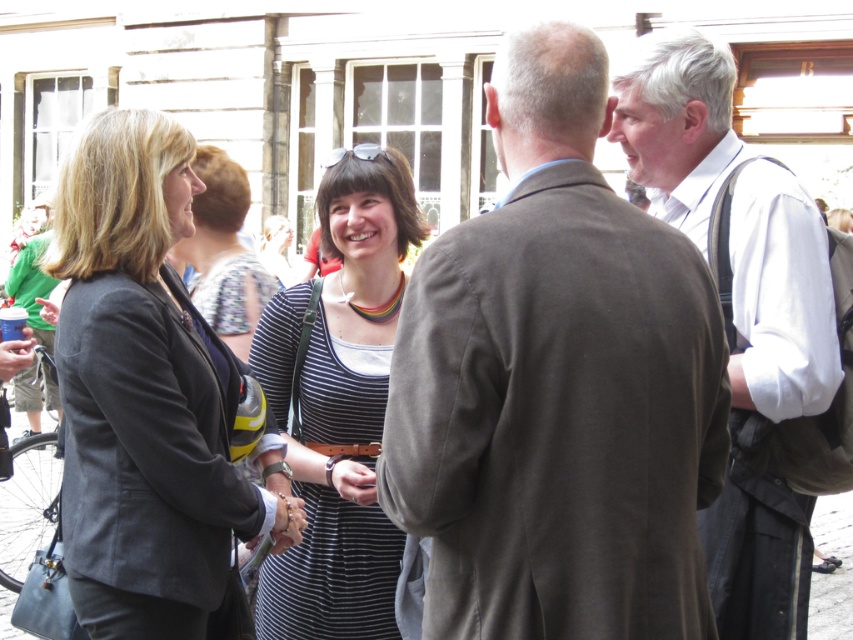
Question: Does white shirt at upper right have a smaller size compared to striped fabric dress at center?

Choices:
 (A) no
 (B) yes

Answer: (A)

Question: Which point is closer to the camera?

Choices:
 (A) gray wool suit at center
 (B) white shirt at upper right

Answer: (A)

Question: Which of the following is the closest to the observer?

Choices:
 (A) gray wool suit at center
 (B) white shirt at upper right
 (C) matte black blazer at left
 (D) striped fabric dress at center

Answer: (A)

Question: Is matte black blazer at left thinner than white shirt at upper right?

Choices:
 (A) yes
 (B) no

Answer: (A)

Question: Among these points, which one is farthest from the camera?

Choices:
 (A) (733, 144)
 (B) (372, 600)
 (C) (169, 602)

Answer: (A)

Question: Does gray wool suit at center appear on the left side of striped fabric dress at center?

Choices:
 (A) yes
 (B) no

Answer: (B)